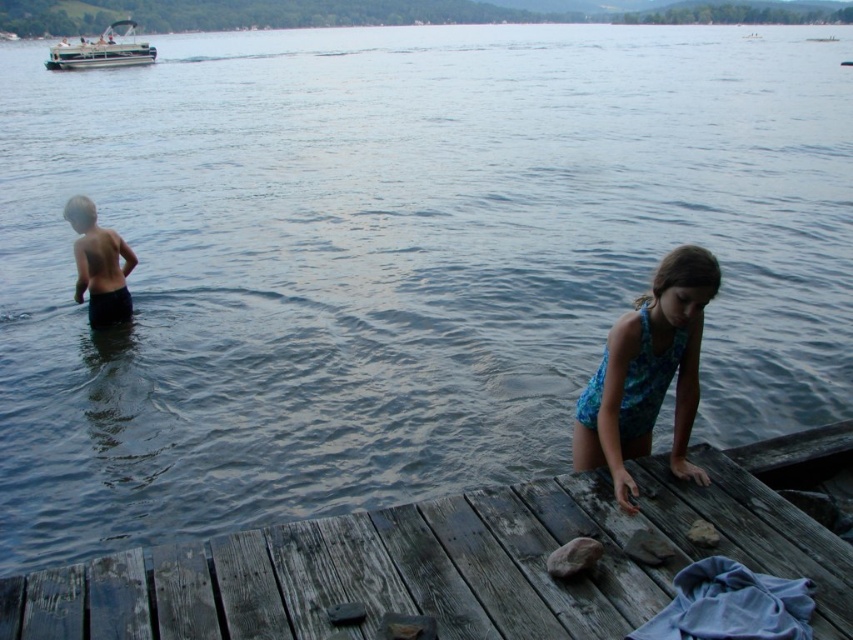
Is weathered wood dock at lower right smaller than dark blue shorts at left?

Incorrect, weathered wood dock at lower right is not smaller in size than dark blue shorts at left.

Where is `weathered wood dock at lower right`? Image resolution: width=853 pixels, height=640 pixels. weathered wood dock at lower right is located at coordinates (459, 561).

Does point (642, 308) lie in front of point (120, 241)?

Yes, point (642, 308) is in front of point (120, 241).

Which is more to the left, blue printed swimsuit at lower right or dark blue shorts at left?

Positioned to the left is dark blue shorts at left.

Is point (664, 273) positioned after point (109, 276)?

No, (664, 273) is closer to viewer.

You are a GUI agent. You are given a task and a screenshot of the screen. Output one action in this format:
    pyautogui.click(x=<x>, y=<y>)
    Task: Click on the blue printed swimsuit at lower right
    This screenshot has height=640, width=853.
    Given the screenshot: What is the action you would take?
    pyautogui.click(x=647, y=372)

Is point (585, 461) closer to viewer compared to point (50, 68)?

Yes, it is.

Is blue printed swimsuit at lower right below white plastic boat at upper left?

Correct, blue printed swimsuit at lower right is located below white plastic boat at upper left.

The image size is (853, 640). What do you see at coordinates (647, 372) in the screenshot?
I see `blue printed swimsuit at lower right` at bounding box center [647, 372].

Locate an element on the screen. This screenshot has height=640, width=853. blue printed swimsuit at lower right is located at coordinates (647, 372).